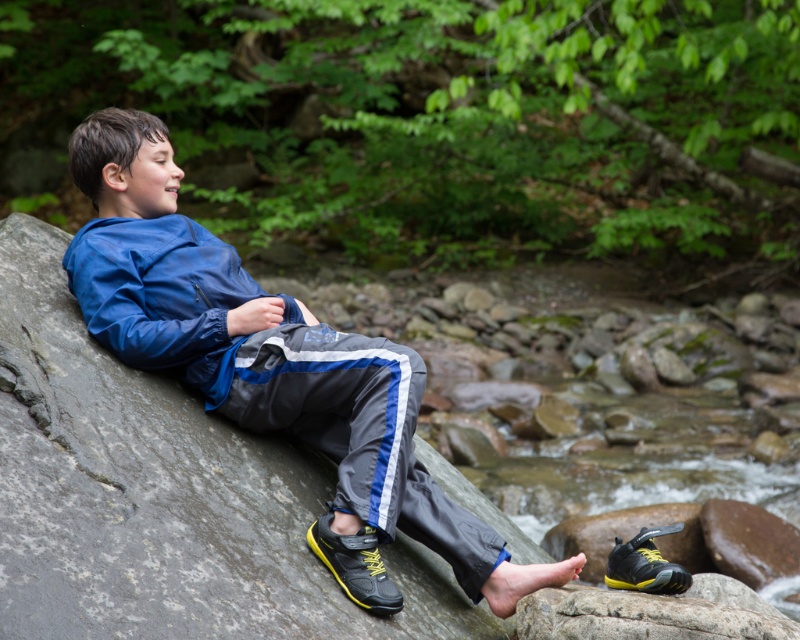
Does blue synthetic jacket at upper left lie in front of yellow matte shoe at lower right?

No, blue synthetic jacket at upper left is further to the viewer.

Image resolution: width=800 pixels, height=640 pixels. I want to click on blue synthetic jacket at upper left, so click(x=162, y=296).

Can you confirm if matte blue jacket at center is taller than yellow matte shoe at lower right?

Yes.

This screenshot has height=640, width=800. I want to click on matte blue jacket at center, so click(x=266, y=355).

What are the coordinates of `matte blue jacket at center` in the screenshot? It's located at (266, 355).

Which is more to the left, matte blue jacket at center or blue synthetic jacket at upper left?

Positioned to the left is blue synthetic jacket at upper left.

Can you confirm if matte blue jacket at center is smaller than blue synthetic jacket at upper left?

No.

The image size is (800, 640). What are the coordinates of `matte blue jacket at center` in the screenshot? It's located at pos(266,355).

The width and height of the screenshot is (800, 640). Identify the location of matte blue jacket at center. (266, 355).